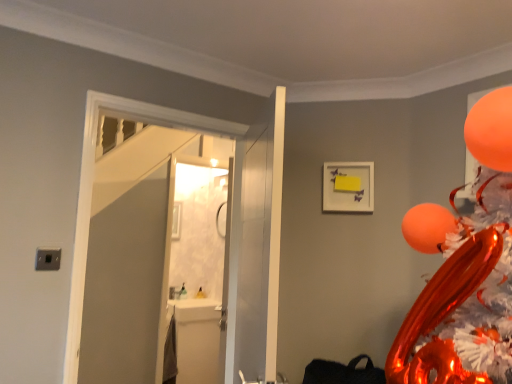
Question: From a real-world perspective, is white matte picture frame at upper center positioned above or below orange glossy balloon at upper right?

Choices:
 (A) above
 (B) below

Answer: (B)

Question: In terms of width, does white matte picture frame at upper center look wider or thinner when compared to orange glossy balloon at upper right?

Choices:
 (A) wide
 (B) thin

Answer: (B)

Question: Which is nearer to the white matte picture frame at upper center?

Choices:
 (A) orange glossy balloon at upper right
 (B) white glossy door at center, the second door when ordered from right to left
 (C) white glossy door at center, the 1th door in the right-to-left sequence
 (D) white glossy sink at lower left

Answer: (B)

Question: Based on their relative distances, which object is farther from the white glossy sink at lower left?

Choices:
 (A) white glossy door at center, which is the 1th door from left to right
 (B) white glossy door at center, the 2th door when ordered from left to right
 (C) white matte picture frame at upper center
 (D) orange glossy balloon at upper right

Answer: (D)